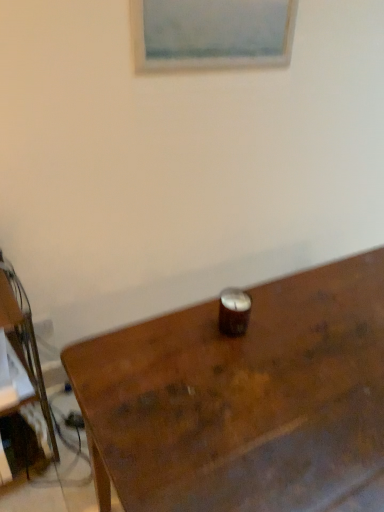
Find the location of `matte white picture frame at upper center`. matte white picture frame at upper center is located at coordinates (212, 34).

You are a GUI agent. You are given a task and a screenshot of the screen. Output one action in this format:
    pyautogui.click(x=<x>, y=<y>)
    Task: Click on the wooden table at center
    The image size is (384, 512).
    Given the screenshot: What is the action you would take?
    pyautogui.click(x=244, y=400)

Does point (149, 453) come closer to viewer compared to point (29, 341)?

Yes, it is.

Is brown wooden desk at left surrounded by wooden table at center?

Definitely not — brown wooden desk at left is not inside wooden table at center.

Between wooden table at center and brown wooden desk at left, which one has larger size?

With larger size is wooden table at center.

At what (x,y) coordinates should I click in order to perform the action: click on picture frame behind the brown wooden desk at left. Please return your answer as a coordinate pair (x, y). The height and width of the screenshot is (512, 384). Looking at the image, I should click on tap(212, 34).

Is the position of brown wooden desk at left less distant than that of matte white picture frame at upper center?

Yes.

Considering the relative sizes of brown wooden desk at left and matte white picture frame at upper center in the image provided, is brown wooden desk at left thinner than matte white picture frame at upper center?

No, brown wooden desk at left is not thinner than matte white picture frame at upper center.

Is matte white picture frame at upper center at the back of brown wooden desk at left?

No, brown wooden desk at left is not facing the opposite direction of matte white picture frame at upper center.

Can you confirm if brown wooden desk at left is positioned to the right of wooden table at center?

In fact, brown wooden desk at left is to the left of wooden table at center.

From a real-world perspective, is brown wooden desk at left on wooden table at center?

No, from a real-world perspective, brown wooden desk at left is not over wooden table at center

Which is behind, point (14, 346) or point (353, 416)?

Positioned behind is point (14, 346).

Which is closer, (x=191, y=316) or (x=230, y=50)?

Clearly, point (x=191, y=316) is closer to the camera than point (x=230, y=50).

Which object is thinner, wooden table at center or matte white picture frame at upper center?

matte white picture frame at upper center.

Looking at this image, does wooden table at center appear on the left side of matte white picture frame at upper center?

In fact, wooden table at center is to the right of matte white picture frame at upper center.

Which of these two, wooden table at center or matte white picture frame at upper center, stands taller?

Standing taller between the two is wooden table at center.

Which object is wider, matte white picture frame at upper center or brown wooden desk at left?

brown wooden desk at left is wider.

From their relative heights in the image, would you say matte white picture frame at upper center is taller or shorter than brown wooden desk at left?

matte white picture frame at upper center is shorter than brown wooden desk at left.

From the image's perspective, which one is positioned higher, matte white picture frame at upper center or brown wooden desk at left?

From the image's view, matte white picture frame at upper center is above.

Would you say brown wooden desk at left is part of matte white picture frame at upper center's contents?

That's incorrect, brown wooden desk at left is not inside matte white picture frame at upper center.

Could you tell me if matte white picture frame at upper center is turned towards wooden table at center?

No, matte white picture frame at upper center is not facing towards wooden table at center.

Can wooden table at center be found inside matte white picture frame at upper center?

Actually, wooden table at center is outside matte white picture frame at upper center.

Would you consider matte white picture frame at upper center to be distant from wooden table at center?

No, there isn't a large distance between matte white picture frame at upper center and wooden table at center.

Considering the relative positions of matte white picture frame at upper center and wooden table at center in the image provided, is matte white picture frame at upper center in front of wooden table at center?

No, the depth of matte white picture frame at upper center is greater than that of wooden table at center.

Identify the location of table below the brown wooden desk at left (from the image's perspective). (244, 400).

Locate an element on the screen. desk that appears on the left of matte white picture frame at upper center is located at coordinates (21, 388).

Estimate the real-world distances between objects in this image. Which object is further from brown wooden desk at left, matte white picture frame at upper center or wooden table at center?

matte white picture frame at upper center is further to brown wooden desk at left.

Estimate the real-world distances between objects in this image. Which object is further from matte white picture frame at upper center, brown wooden desk at left or wooden table at center?

brown wooden desk at left lies further to matte white picture frame at upper center than the other object.

Considering their positions, is matte white picture frame at upper center positioned closer to wooden table at center than brown wooden desk at left?

The object closer to wooden table at center is brown wooden desk at left.

Based on their spatial positions, is brown wooden desk at left or matte white picture frame at upper center further from wooden table at center?

matte white picture frame at upper center.

Based on their spatial positions, is wooden table at center or brown wooden desk at left closer to matte white picture frame at upper center?

Based on the image, wooden table at center appears to be nearer to matte white picture frame at upper center.

In the scene shown: Based on their spatial positions, is wooden table at center or matte white picture frame at upper center further from brown wooden desk at left?

matte white picture frame at upper center is positioned further to the anchor brown wooden desk at left.

I want to click on desk between matte white picture frame at upper center and wooden table at center in the vertical direction, so click(21, 388).